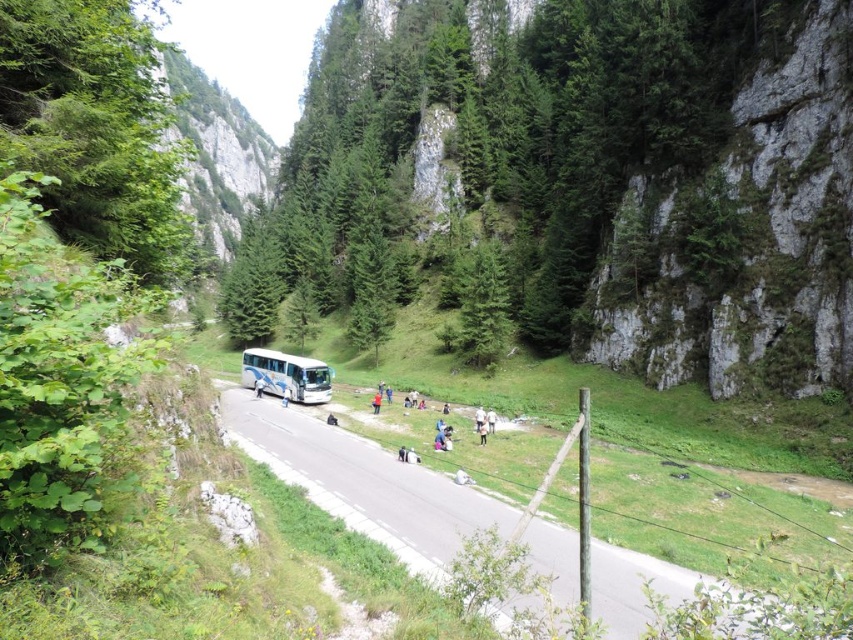
Question: Which point is farther to the camera?

Choices:
 (A) (305, 358)
 (B) (90, 1)
 (C) (558, 547)

Answer: (A)

Question: Can you confirm if green leafy tree at left is positioned to the left of white glossy tour bus at center?

Choices:
 (A) yes
 (B) no

Answer: (A)

Question: Does green leafy tree at left appear on the left side of white asphalt road at center?

Choices:
 (A) yes
 (B) no

Answer: (A)

Question: Which of these objects is positioned farthest from the white asphalt road at center?

Choices:
 (A) white glossy tour bus at center
 (B) green leafy tree at left

Answer: (A)

Question: Which of the following is the closest to the observer?

Choices:
 (A) white asphalt road at center
 (B) white glossy tour bus at center

Answer: (A)

Question: Observing the image, what is the correct spatial positioning of white asphalt road at center in reference to white glossy tour bus at center?

Choices:
 (A) left
 (B) right

Answer: (B)